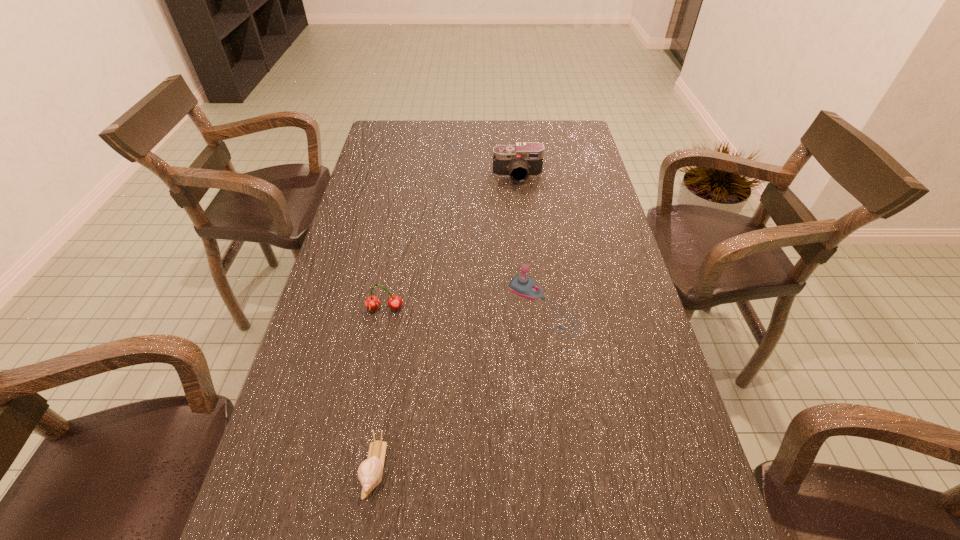
Image resolution: width=960 pixels, height=540 pixels. What are the coordinates of `unoccupied area between the farthest object and the escargot` in the screenshot? It's located at (446, 322).

Find the location of a particular element. free space between the joystick and the farthest object is located at coordinates (530, 241).

Locate an element on the screen. Image resolution: width=960 pixels, height=540 pixels. vacant space that is in between the cherry and the joystick is located at coordinates (464, 307).

Identify the location of free space between the camera and the joystick. The width and height of the screenshot is (960, 540). (530, 241).

Choose which object is the third nearest neighbor to the camera. Please provide its 2D coordinates. Your answer should be formatted as a tuple, i.e. [(x, y)], where the tuple contains the x and y coordinates of a point satisfying the conditions above.

[(370, 471)]

Locate which object is the third closest to the escargot. Please provide its 2D coordinates. Your answer should be formatted as a tuple, i.e. [(x, y)], where the tuple contains the x and y coordinates of a point satisfying the conditions above.

[(524, 159)]